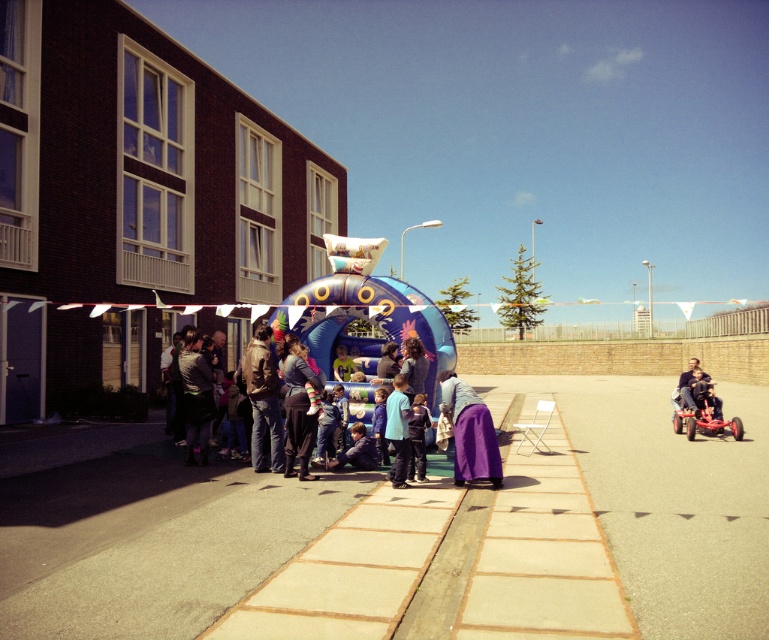
Question: Is the position of red plastic baby carriage at lower right less distant than that of matte black scooter at right?

Choices:
 (A) yes
 (B) no

Answer: (A)

Question: Does purple fabric at lower center have a smaller size compared to matte black scooter at right?

Choices:
 (A) yes
 (B) no

Answer: (B)

Question: In this image, where is smooth concrete pavement at center located relative to blue matte shirt at center?

Choices:
 (A) left
 (B) right

Answer: (B)

Question: Which point is farther to the camera?

Choices:
 (A) purple fabric at lower center
 (B) matte black scooter at right
 (C) red plastic baby carriage at lower right
 (D) dark blue jeans at lower center

Answer: (B)

Question: Among these points, which one is farthest from the camera?

Choices:
 (A) (308, 451)
 (B) (691, 376)

Answer: (B)

Question: Which object is farther from the camera taking this photo?

Choices:
 (A) purple fabric at center
 (B) matte black scooter at right
 (C) blue matte shirt at center
 (D) purple fabric at lower center

Answer: (B)